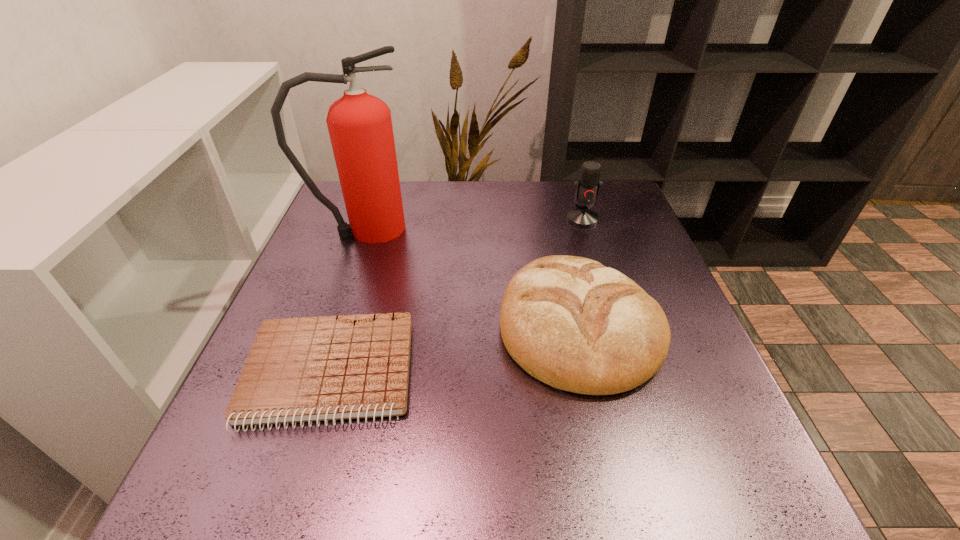
At what (x,y) coordinates should I click in order to perform the action: click on fire extinguisher. Please return your answer as a coordinate pair (x, y). The image size is (960, 540). Looking at the image, I should click on (360, 127).

The width and height of the screenshot is (960, 540). I want to click on microphone, so click(x=587, y=187).

This screenshot has width=960, height=540. I want to click on bread, so click(572, 323).

Find the location of a particular element. The image size is (960, 540). the shortest object is located at coordinates (306, 369).

Where is `vacant space located on the handle side of the fire extinguisher`? This screenshot has width=960, height=540. vacant space located on the handle side of the fire extinguisher is located at coordinates (462, 228).

The width and height of the screenshot is (960, 540). In order to click on vacant space located 0.060m on the side of the second tallest object with the red ring in this screenshot , I will do `click(589, 241)`.

You are a GUI agent. You are given a task and a screenshot of the screen. Output one action in this format:
    pyautogui.click(x=<x>, y=<y>)
    Task: Click on the free point located on the left of the bread
    
    Given the screenshot: What is the action you would take?
    pyautogui.click(x=372, y=326)

At what (x,y) coordinates should I click in order to perform the action: click on free region located 0.150m on the right of the shortest object. Please return your answer as a coordinate pair (x, y). Image resolution: width=960 pixels, height=540 pixels. Looking at the image, I should click on (494, 373).

The width and height of the screenshot is (960, 540). What are the coordinates of `fire extinguisher present at the far edge` in the screenshot? It's located at (360, 127).

Where is `microphone that is at the far edge`? Image resolution: width=960 pixels, height=540 pixels. microphone that is at the far edge is located at coordinates (587, 187).